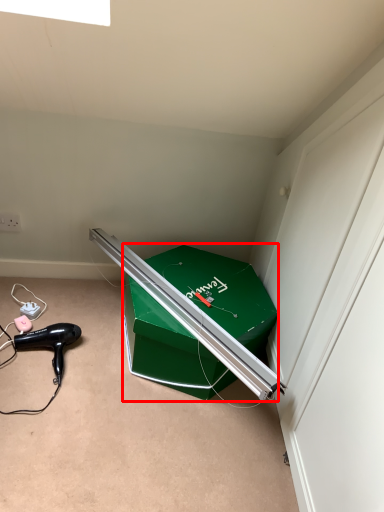
Question: Observing the image, what is the correct spatial positioning of box (annotated by the red box) in reference to hair drier?

Choices:
 (A) right
 (B) left

Answer: (A)